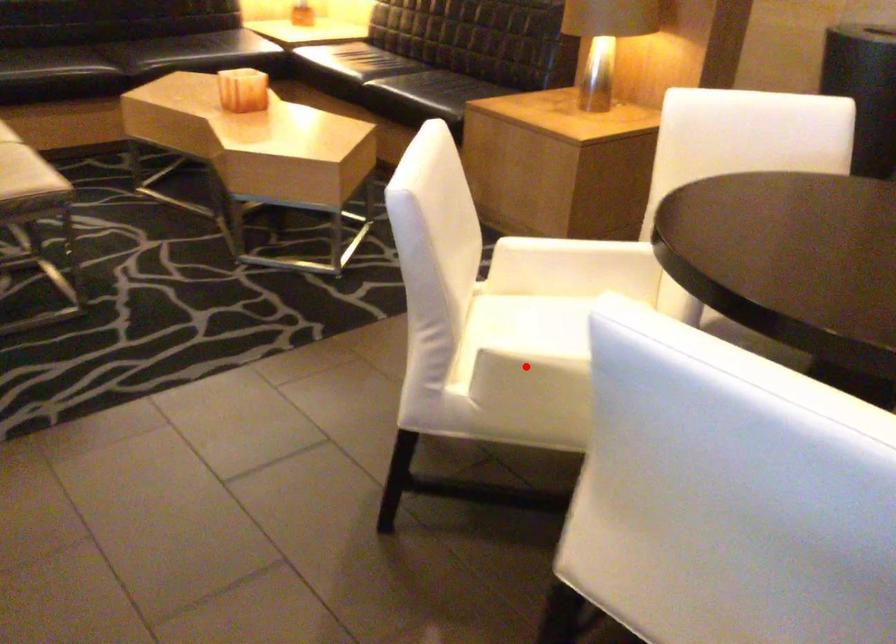
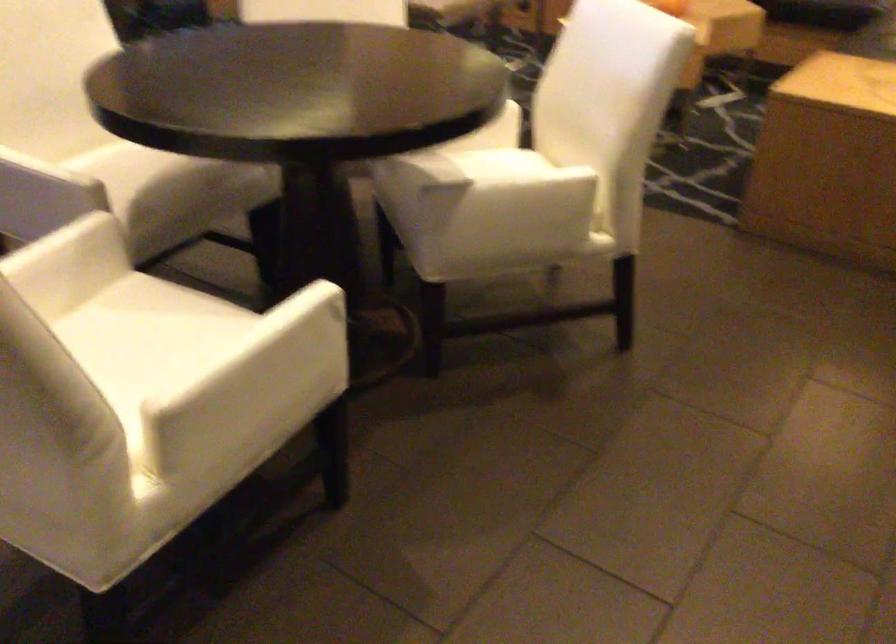
Question: I am providing you with two images of the same scene from different viewpoints. A red point is marked on the first image. At the location where the point appears in image 1, is it still visible in image 2?

Choices:
 (A) Yes
 (B) No

Answer: (B)